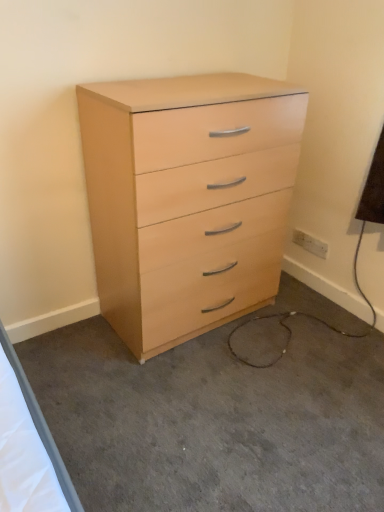
The width and height of the screenshot is (384, 512). What are the coordinates of `vacant area on top of light wood dresser at center (from a real-world perspective)` in the screenshot? It's located at (233, 385).